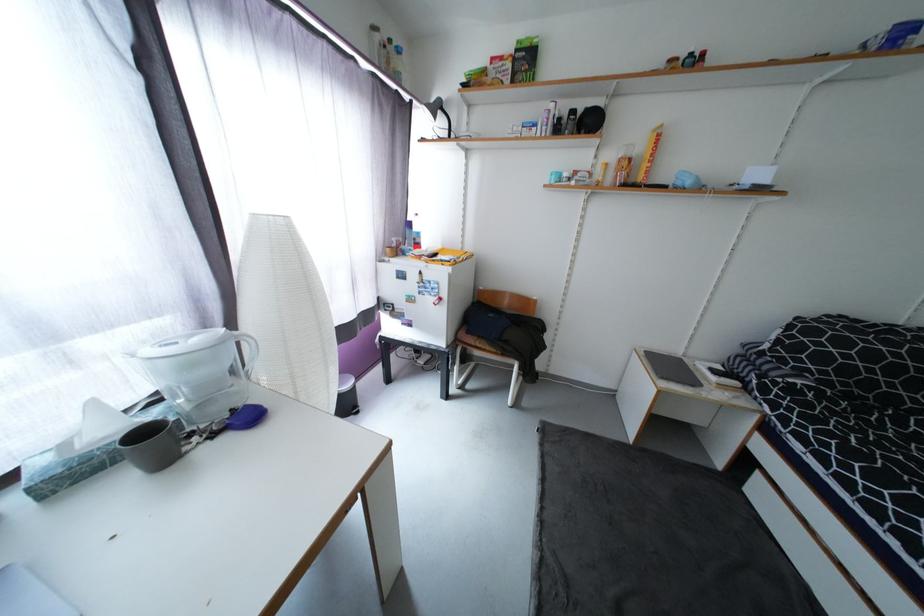
This screenshot has height=616, width=924. What are the coordinates of `white spray can` in the screenshot? It's located at (199, 371).